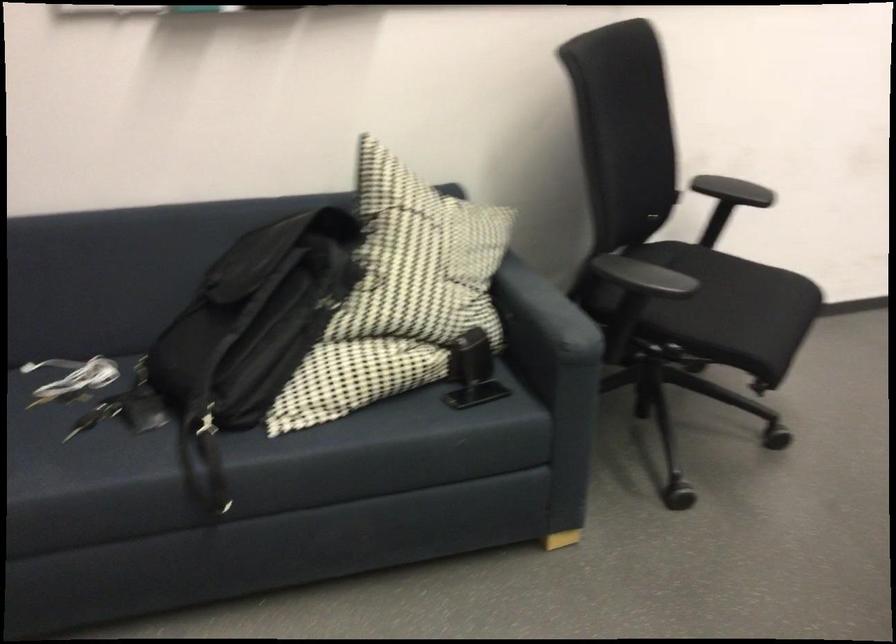
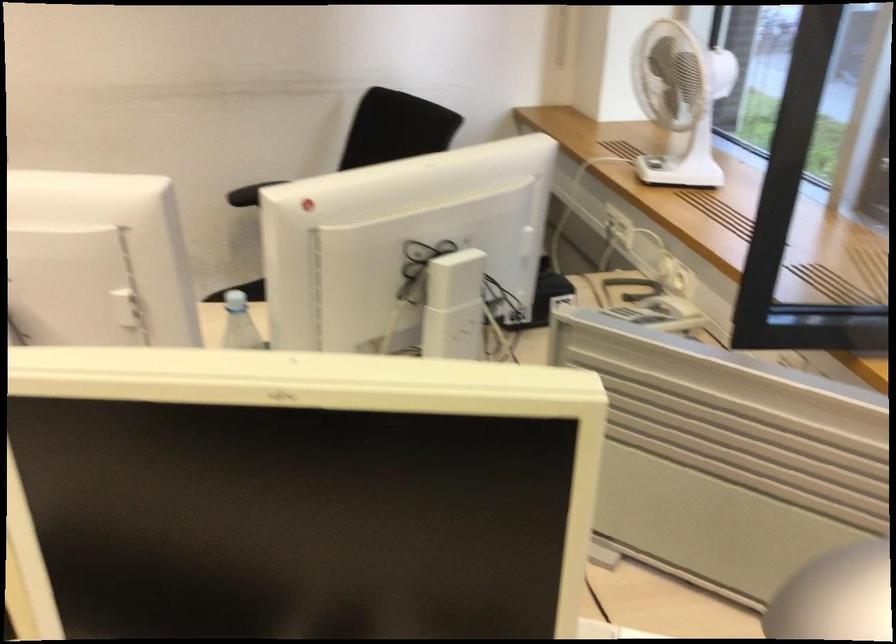
Question: What movement of the cameraman would produce the second image?

Choices:
 (A) Left
 (B) Right
 (C) Forward
 (D) Backward

Answer: (B)